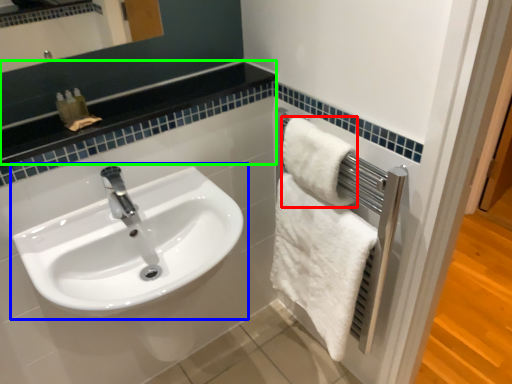
Question: Which object is positioned closest to towel (highlighted by a red box)? Select from sink (highlighted by a blue box) and balustrade (highlighted by a green box).

Choices:
 (A) sink
 (B) balustrade

Answer: (B)